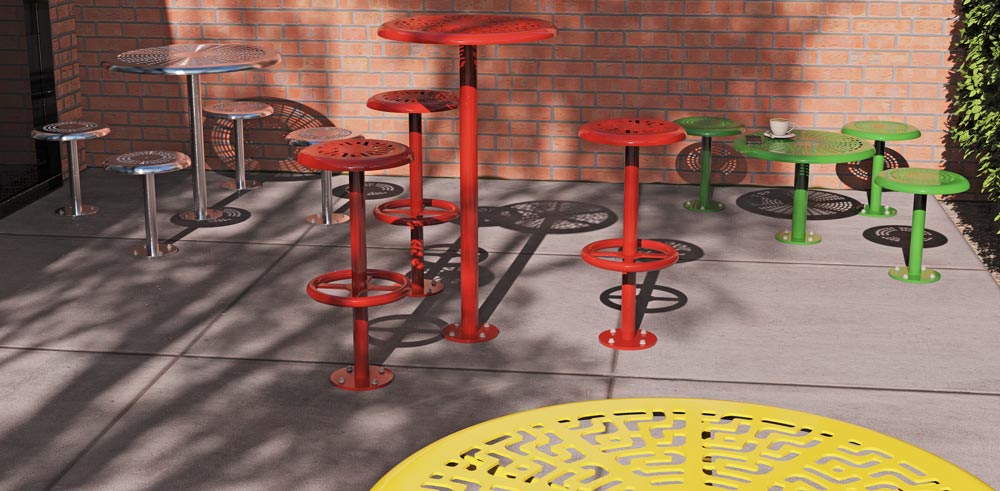
Identify the location of chrome circle seating. (71, 114), (120, 159), (232, 114).